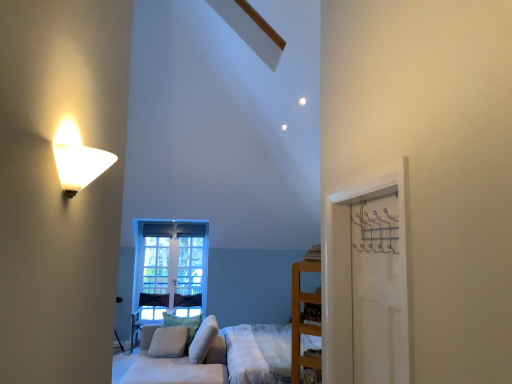
Question: Is white matte door at right to the right of metallic silver hanger at right from the viewer's perspective?

Choices:
 (A) yes
 (B) no

Answer: (A)

Question: Can you confirm if white matte door at right is thinner than metallic silver hanger at right?

Choices:
 (A) no
 (B) yes

Answer: (B)

Question: Considering the relative positions of white matte door at right and metallic silver hanger at right in the image provided, is white matte door at right behind metallic silver hanger at right?

Choices:
 (A) no
 (B) yes

Answer: (A)

Question: Considering the relative sizes of white matte door at right and metallic silver hanger at right in the image provided, is white matte door at right wider than metallic silver hanger at right?

Choices:
 (A) no
 (B) yes

Answer: (A)

Question: Is white matte door at right beside metallic silver hanger at right?

Choices:
 (A) no
 (B) yes

Answer: (A)

Question: Is white matte door at right facing away from metallic silver hanger at right?

Choices:
 (A) no
 (B) yes

Answer: (B)

Question: Is metallic silver hanger at right outside of wooden shelf at right?

Choices:
 (A) yes
 (B) no

Answer: (A)

Question: Is metallic silver hanger at right far away from wooden shelf at right?

Choices:
 (A) yes
 (B) no

Answer: (B)

Question: Does metallic silver hanger at right have a smaller size compared to wooden shelf at right?

Choices:
 (A) yes
 (B) no

Answer: (A)

Question: Does metallic silver hanger at right appear on the left side of wooden shelf at right?

Choices:
 (A) no
 (B) yes

Answer: (A)

Question: Considering the relative sizes of metallic silver hanger at right and wooden shelf at right in the image provided, is metallic silver hanger at right shorter than wooden shelf at right?

Choices:
 (A) yes
 (B) no

Answer: (A)

Question: Is metallic silver hanger at right directly adjacent to wooden shelf at right?

Choices:
 (A) no
 (B) yes

Answer: (A)

Question: Would you say wooden bed frame at lower center contains wooden shelf at right?

Choices:
 (A) yes
 (B) no

Answer: (B)